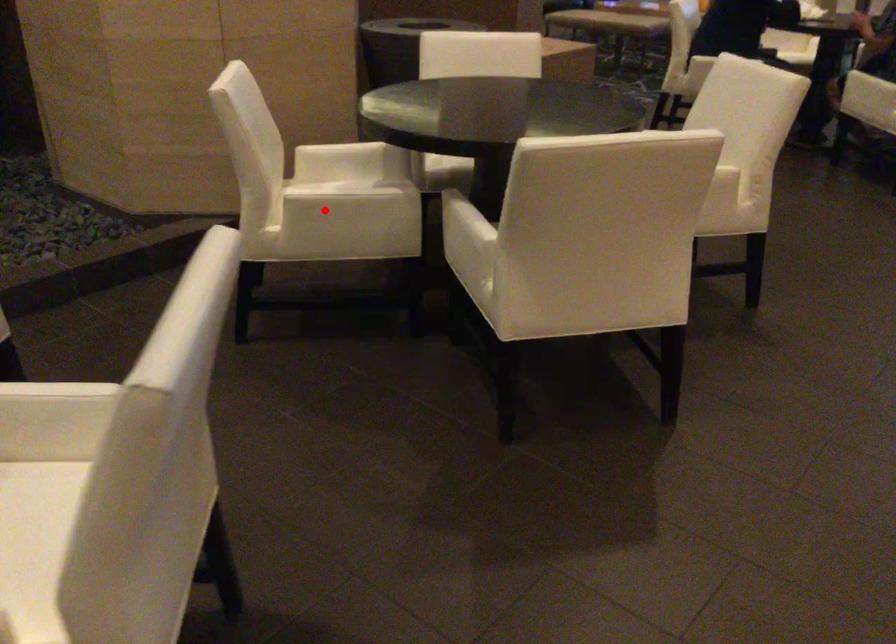
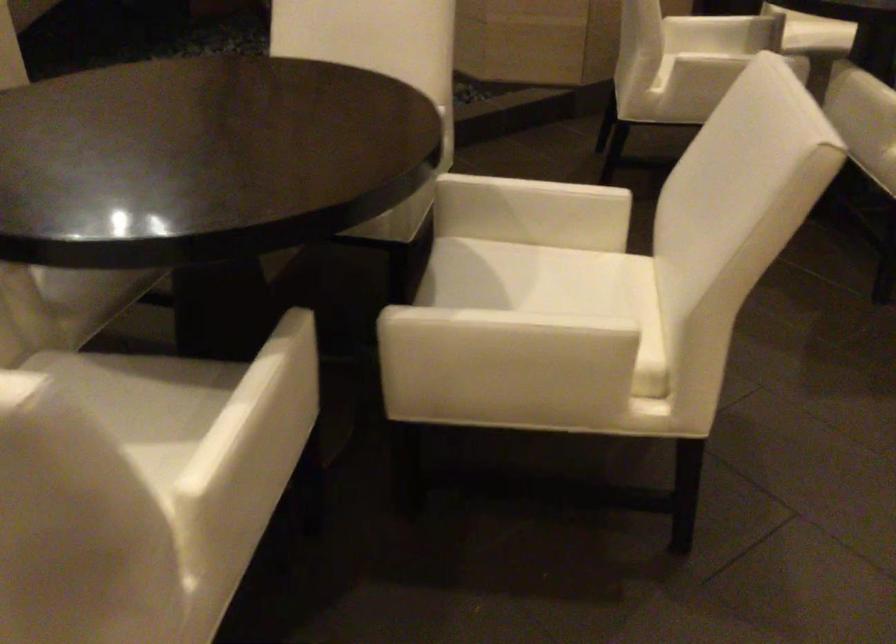
Locate, in the second image, the point that corresponds to the highlighted location in the first image.

(726, 60)